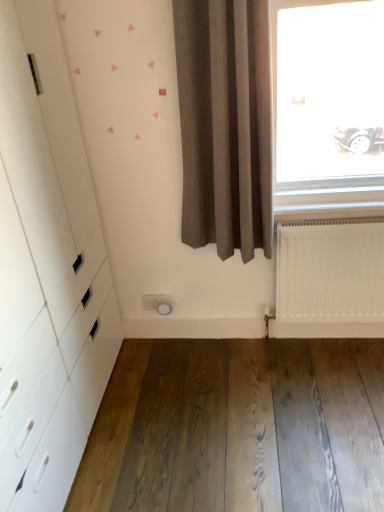
Question: Is natural wood floor at lower center spatially inside white matte radiator at lower right, or outside of it?

Choices:
 (A) inside
 (B) outside

Answer: (B)

Question: From a real-world perspective, is natural wood floor at lower center physically located above or below white matte radiator at lower right?

Choices:
 (A) above
 (B) below

Answer: (B)

Question: Which is nearer to the natural wood floor at lower center?

Choices:
 (A) white glossy dresser at left
 (B) white matte radiator at lower right
 (C) brown fabric curtain at center

Answer: (B)

Question: Based on their relative distances, which object is nearer to the white matte radiator at lower right?

Choices:
 (A) white glossy dresser at left
 (B) natural wood floor at lower center
 (C) brown fabric curtain at center

Answer: (C)